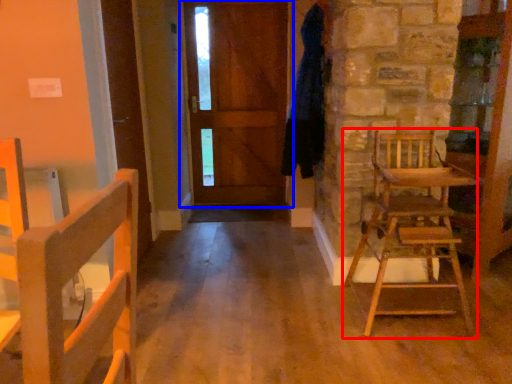
Question: Among these objects, which one is farthest to the camera, chair (highlighted by a red box) or door (highlighted by a blue box)?

Choices:
 (A) chair
 (B) door

Answer: (B)